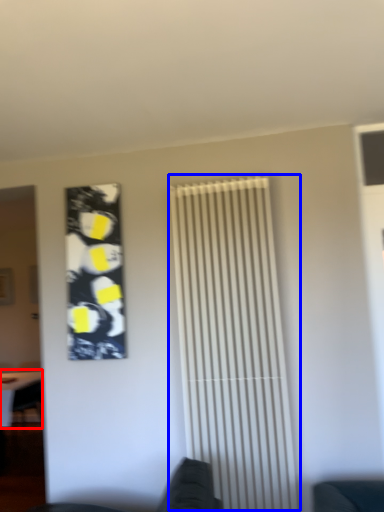
Question: Which point is further to the camera, table (highlighted by a red box) or shutter (highlighted by a blue box)?

Choices:
 (A) table
 (B) shutter

Answer: (A)